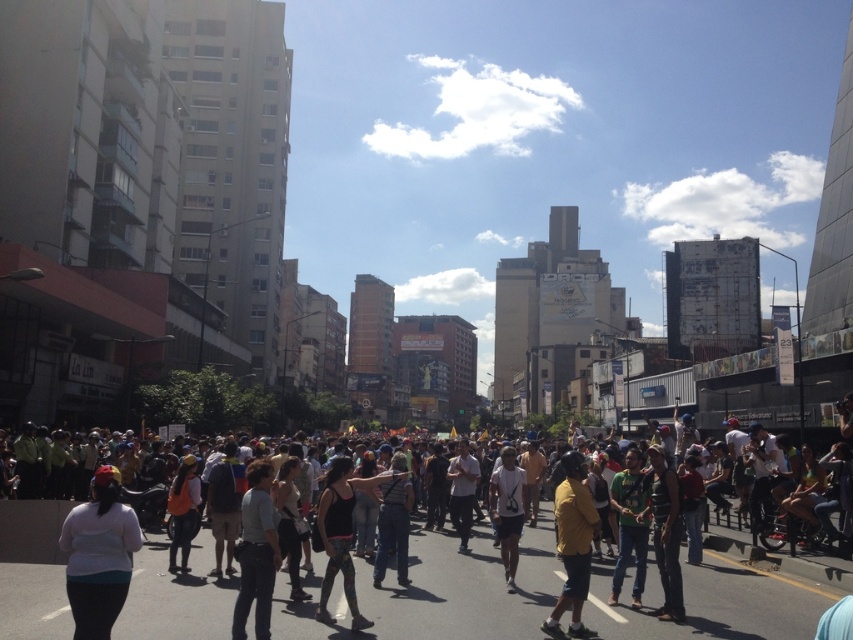
Between multicolored casual attire at center and white matte shirt at lower left, which one is positioned higher?

Positioned higher is white matte shirt at lower left.

Can you confirm if multicolored casual attire at center is wider than white matte shirt at lower left?

Yes.

Which is behind, point (410, 577) or point (109, 522)?

Point (410, 577)

You are a GUI agent. You are given a task and a screenshot of the screen. Output one action in this format:
    pyautogui.click(x=<x>, y=<y>)
    Task: Click on the multicolored casual attire at center
    
    Given the screenshot: What is the action you would take?
    [463, 592]